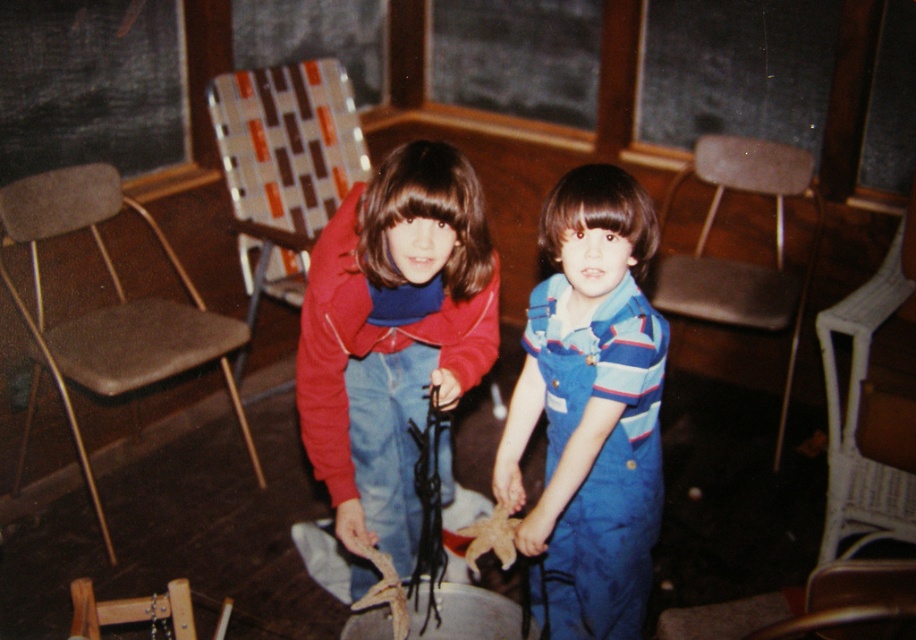
Is white wicker chair at lower right positioned in front of brown leather chair at lower right?

No, white wicker chair at lower right is behind brown leather chair at lower right.

Can you confirm if white wicker chair at lower right is smaller than brown leather chair at lower right?

Actually, white wicker chair at lower right might be larger than brown leather chair at lower right.

Describe the element at coordinates (857, 419) in the screenshot. I see `white wicker chair at lower right` at that location.

At what (x,y) coordinates should I click in order to perform the action: click on white wicker chair at lower right. Please return your answer as a coordinate pair (x, y). Looking at the image, I should click on (857, 419).

Between point (355, 483) and point (662, 340), which one is positioned behind?

The point (355, 483) is more distant.

Between point (443, 160) and point (593, 257), which one is positioned in front?

Point (593, 257) is in front.

Which is in front, point (385, 461) or point (552, 420)?

Point (552, 420)

Where is `matte red sweater at center`? The height and width of the screenshot is (640, 916). matte red sweater at center is located at coordinates click(389, 348).

Is point (344, 472) positioned in front of point (851, 596)?

No, (344, 472) is further to viewer.

Is the position of matte red sweater at center more distant than that of brown leather chair at lower right?

Yes.

Is point (307, 556) closer to camera compared to point (838, 627)?

No, it is behind (838, 627).

Locate an element on the screen. Image resolution: width=916 pixels, height=640 pixels. matte red sweater at center is located at coordinates (389, 348).